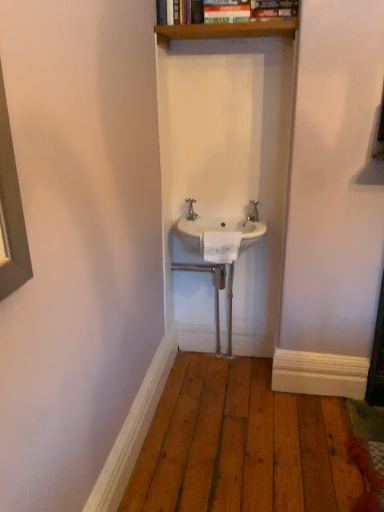
Question: Does white plastic towel bar at center lie behind silver metallic tap at center?

Choices:
 (A) no
 (B) yes

Answer: (A)

Question: Is white plastic towel bar at center to the right of silver metallic tap at center from the viewer's perspective?

Choices:
 (A) no
 (B) yes

Answer: (B)

Question: Is white plastic towel bar at center closer to the viewer compared to silver metallic tap at center?

Choices:
 (A) no
 (B) yes

Answer: (B)

Question: Are white plastic towel bar at center and silver metallic tap at center located far from each other?

Choices:
 (A) yes
 (B) no

Answer: (B)

Question: Can we say white plastic towel bar at center lies outside silver metallic tap at center?

Choices:
 (A) no
 (B) yes

Answer: (B)

Question: Considering the relative sizes of white plastic towel bar at center and silver metallic tap at center in the image provided, is white plastic towel bar at center shorter than silver metallic tap at center?

Choices:
 (A) no
 (B) yes

Answer: (A)

Question: Is wooden shelf at upper center outside of silver metallic tap at center?

Choices:
 (A) no
 (B) yes

Answer: (B)

Question: Is wooden shelf at upper center oriented towards silver metallic tap at center?

Choices:
 (A) no
 (B) yes

Answer: (A)

Question: Does wooden shelf at upper center lie behind silver metallic tap at center?

Choices:
 (A) no
 (B) yes

Answer: (A)

Question: Can you confirm if wooden shelf at upper center is bigger than silver metallic tap at center?

Choices:
 (A) yes
 (B) no

Answer: (A)

Question: From the image's perspective, is wooden shelf at upper center located beneath silver metallic tap at center?

Choices:
 (A) no
 (B) yes

Answer: (A)

Question: Is wooden shelf at upper center to the right of silver metallic tap at center from the viewer's perspective?

Choices:
 (A) yes
 (B) no

Answer: (A)

Question: Would you consider white plastic towel bar at center to be distant from white ceramic sink at center?

Choices:
 (A) yes
 (B) no

Answer: (B)